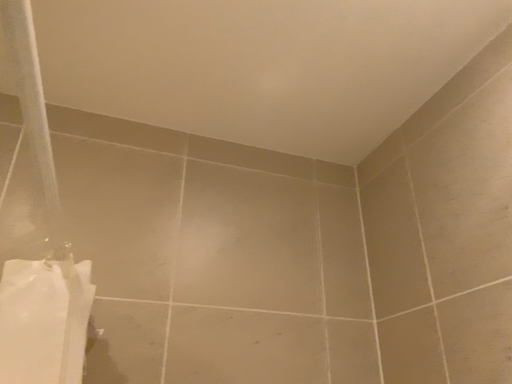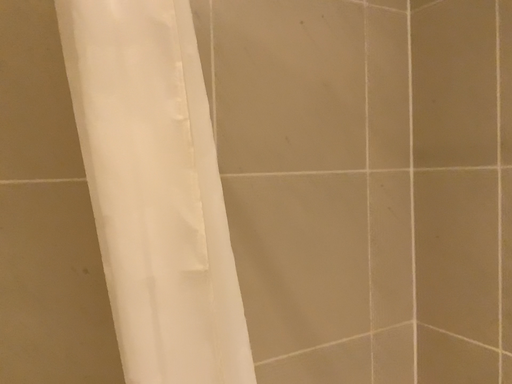
Question: Which way did the camera rotate in the video?

Choices:
 (A) rotated downward
 (B) rotated upward

Answer: (A)